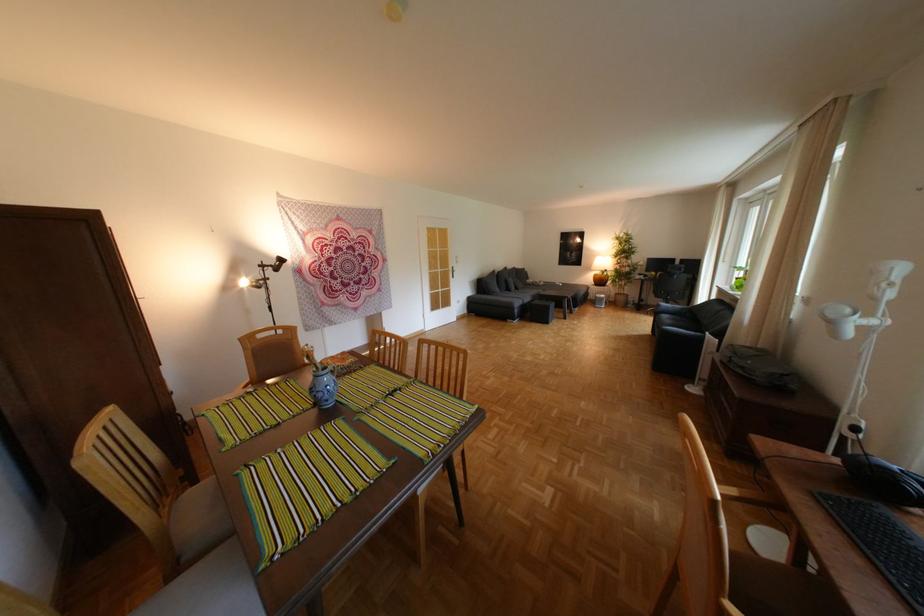
What do you see at coordinates (700, 331) in the screenshot? The image size is (924, 616). I see `the sofa armrest` at bounding box center [700, 331].